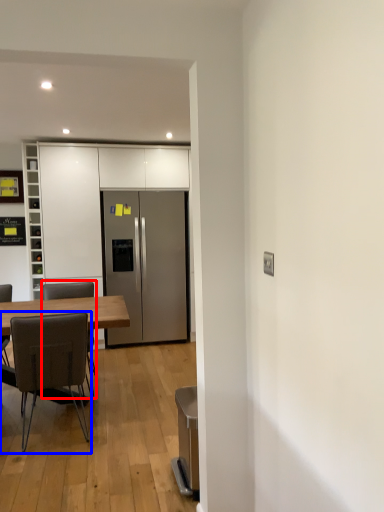
Question: Which object is further to the camera taking this photo, chair (highlighted by a red box) or chair (highlighted by a blue box)?

Choices:
 (A) chair
 (B) chair

Answer: (A)